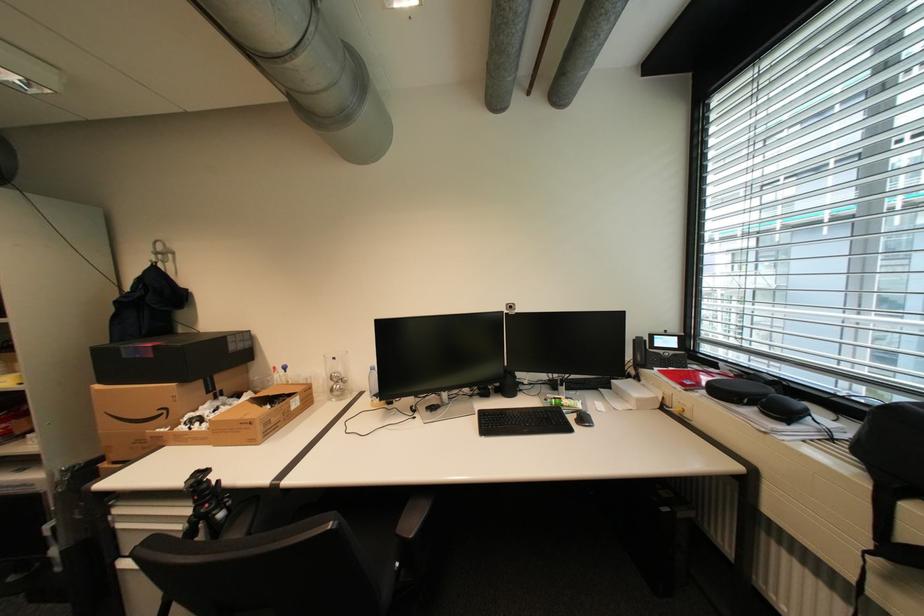
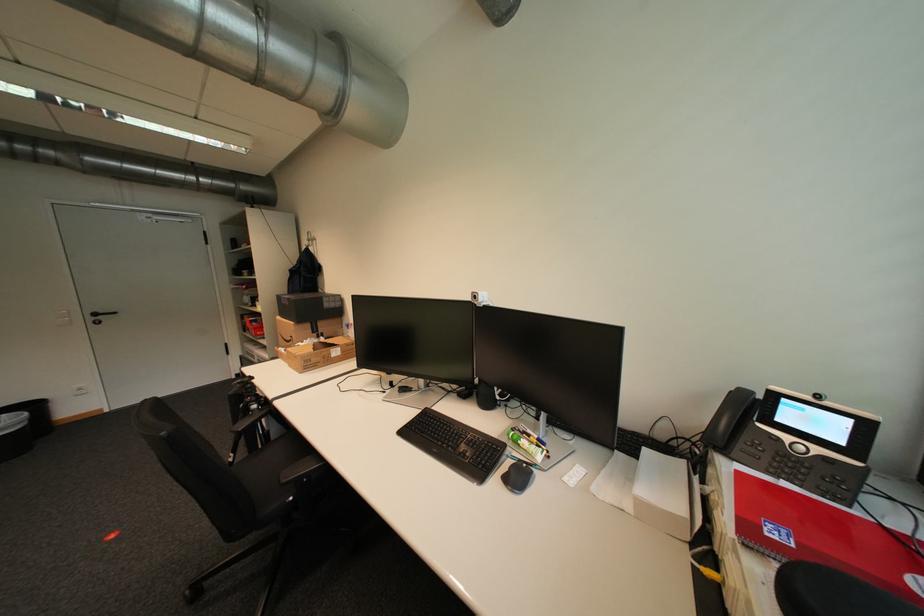
The point at (686, 347) is marked in the first image. Where is the corresponding point in the second image?

(850, 443)